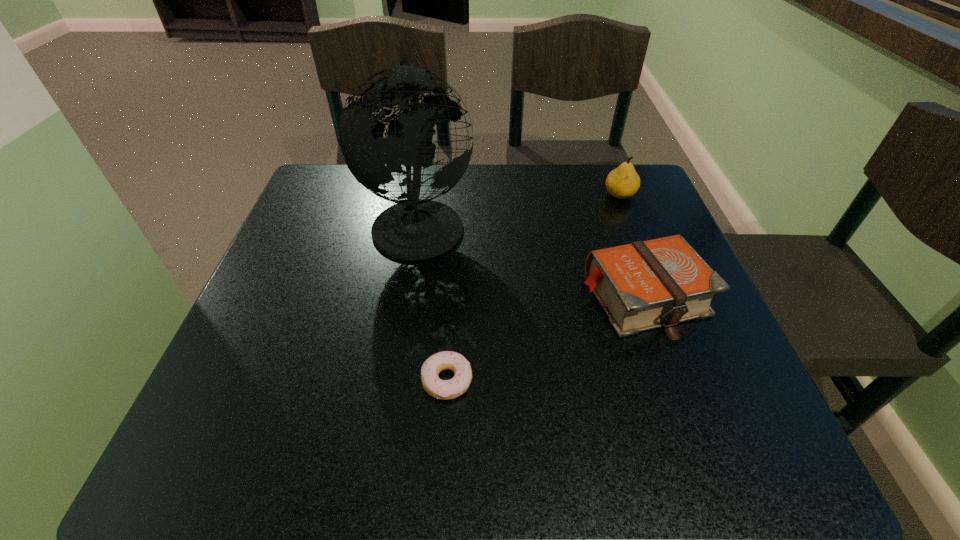
Locate an element on the screen. The image size is (960, 540). pear at the far edge is located at coordinates (623, 182).

Locate an element on the screen. The image size is (960, 540). pear that is at the right edge is located at coordinates (623, 182).

At what (x,y) coordinates should I click in order to perform the action: click on Bible present at the right edge. Please return your answer as a coordinate pair (x, y). Looking at the image, I should click on (643, 285).

Where is `object positioned at the far right corner`? The width and height of the screenshot is (960, 540). object positioned at the far right corner is located at coordinates (623, 182).

Find the location of `vacant region at the far edge of the desktop`. vacant region at the far edge of the desktop is located at coordinates (532, 190).

This screenshot has width=960, height=540. In the image, there is a desktop. Identify the location of vacant space at the left edge. (268, 414).

You are a GUI agent. You are given a task and a screenshot of the screen. Output one action in this format:
    pyautogui.click(x=<x>, y=<y>)
    Task: Click on the free spot at the right edge of the desktop
    
    Given the screenshot: What is the action you would take?
    pos(700,395)

This screenshot has height=540, width=960. In the image, there is a desktop. What are the coordinates of `vacant space at the far left corner` in the screenshot? It's located at (325, 201).

I want to click on vacant area at the far right corner, so click(586, 171).

I want to click on free space between the pear and the tallest object, so coord(519,209).